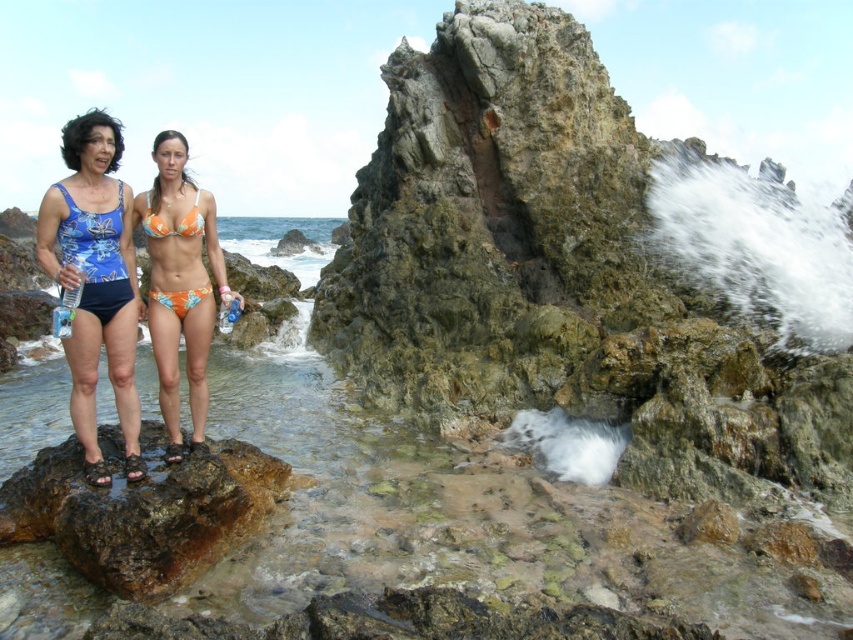
You are a photographer trying to capture a photo of both the orange printed bikini at center and the blue printed fabric bikini at left. Since you want them to be in the same frame, which one should you adjust to be closer to the camera so that their heights in the photo appear more balanced?

The orange printed bikini at center is taller than the blue printed fabric bikini at left. To balance their heights in the photo, you should move the orange printed bikini at center closer to the camera so that its height in the photo matches the blue printed fabric bikini at left.

You are a photographer trying to capture a photo of the blue fabric swimsuit at left in the coastal scene. Based on the coordinates provided, where should you position your camera to ensure the swimsuit is centered in the frame?

The blue fabric swimsuit at left is located at coordinates 0.439 on the x axis and 0.113 on the y axis, so you should position your camera so that the center of the frame aligns with these coordinates to capture the swimsuit.